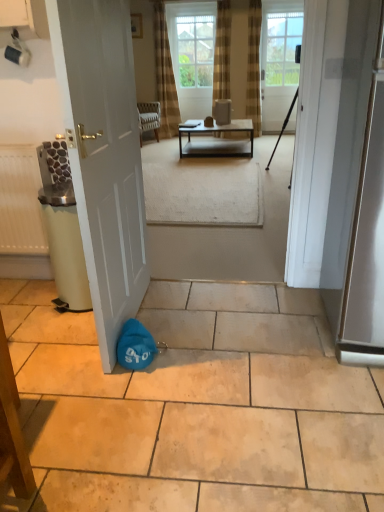
Find the location of `vacant space positioned to the left of white matte door at left, positioned as the first door in bottom-to-top order`. vacant space positioned to the left of white matte door at left, positioned as the first door in bottom-to-top order is located at coordinates [49, 326].